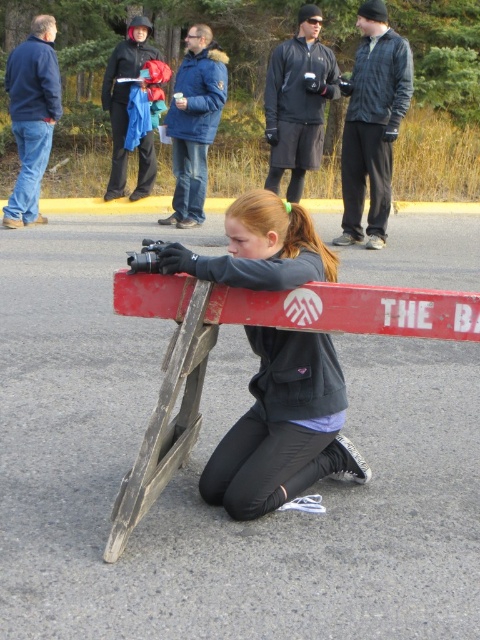
Question: Can you confirm if matte gray jacket at center is positioned to the left of matte black jacket at upper center?

Choices:
 (A) no
 (B) yes

Answer: (B)

Question: Which point is closer to the camera taking this photo?

Choices:
 (A) (321, 458)
 (B) (283, 74)
 (C) (391, 168)

Answer: (A)

Question: Can you confirm if matte gray jacket at center is positioned to the right of dark gray jacket at upper center?

Choices:
 (A) no
 (B) yes

Answer: (A)

Question: Which object is farther from the camera taking this photo?

Choices:
 (A) dark gray jacket at upper center
 (B) matte gray jacket at center

Answer: (A)

Question: Can you confirm if matte gray jacket at center is wider than matte black jacket at upper center?

Choices:
 (A) no
 (B) yes

Answer: (B)

Question: Which is nearer to the dark gray jacket at upper center?

Choices:
 (A) matte black jacket at upper center
 (B) matte gray jacket at center

Answer: (A)